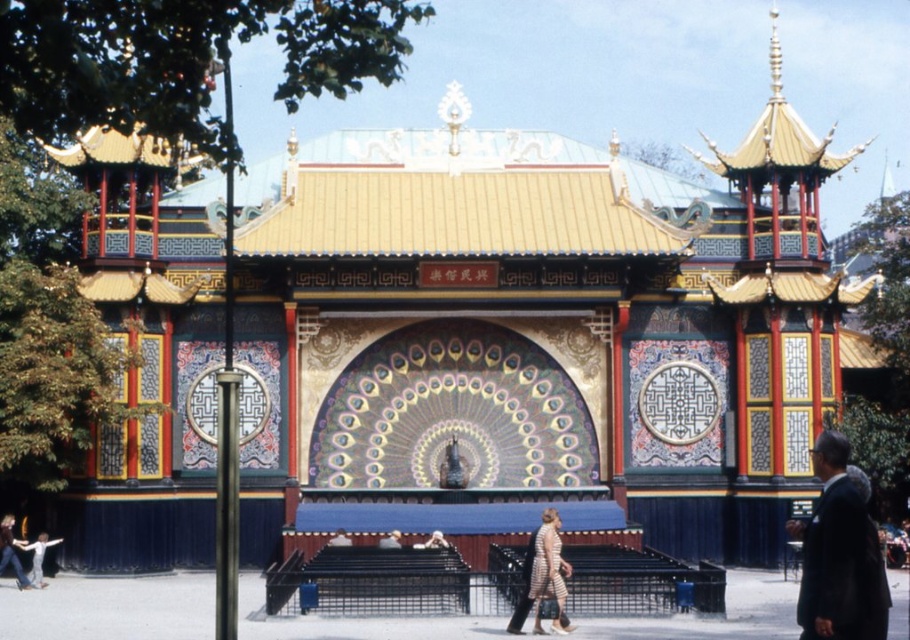
Question: Observing the image, what is the correct spatial positioning of dark suit at right in reference to striped fabric dress at center?

Choices:
 (A) right
 (B) left

Answer: (A)

Question: Is dark suit at right wider than striped fabric dress at center?

Choices:
 (A) yes
 (B) no

Answer: (A)

Question: Does dark suit at right have a greater width compared to striped fabric dress at center?

Choices:
 (A) yes
 (B) no

Answer: (A)

Question: Among these points, which one is farthest from the camera?

Choices:
 (A) (548, 520)
 (B) (882, 611)

Answer: (A)

Question: Which point is farther to the camera?

Choices:
 (A) (850, 532)
 (B) (561, 572)

Answer: (B)